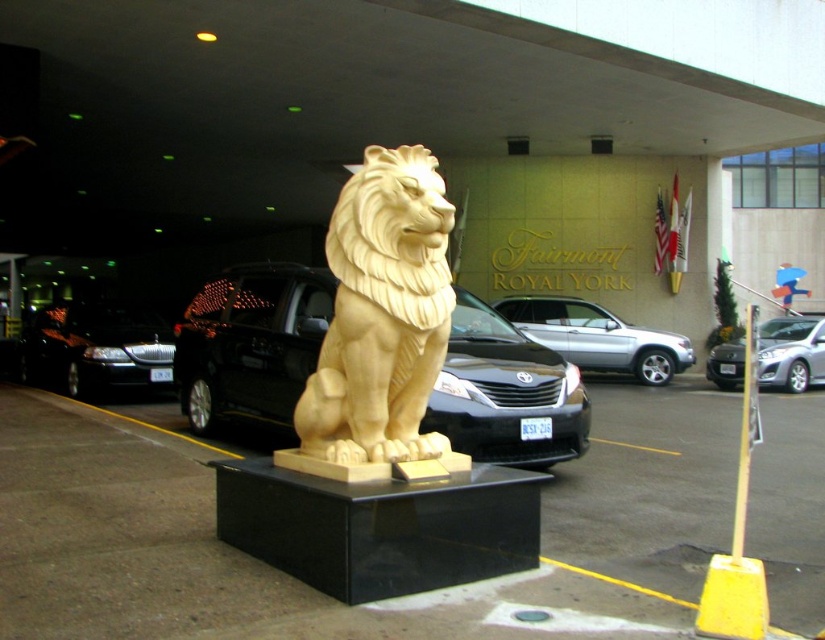
Question: Which point appears farthest from the camera in this image?

Choices:
 (A) (786, 536)
 (B) (760, 330)
 (C) (50, 365)

Answer: (B)

Question: Is matte gold lion statue at center behind golden carved lion at center?

Choices:
 (A) no
 (B) yes

Answer: (A)

Question: Which of these objects is positioned farthest from the golden carved lion at center?

Choices:
 (A) shiny black sedan at left
 (B) satin silver sedan at center
 (C) satin black car at center

Answer: (B)

Question: Which of the following is the closest to the observer?

Choices:
 (A) shiny black sedan at left
 (B) satin silver suv at center
 (C) satin black car at center
 (D) matte gold lion statue at center

Answer: (D)

Question: Is satin black car at center to the left of satin silver suv at center from the viewer's perspective?

Choices:
 (A) no
 (B) yes

Answer: (B)

Question: In this image, where is matte gold lion statue at center located relative to satin silver suv at center?

Choices:
 (A) left
 (B) right

Answer: (A)